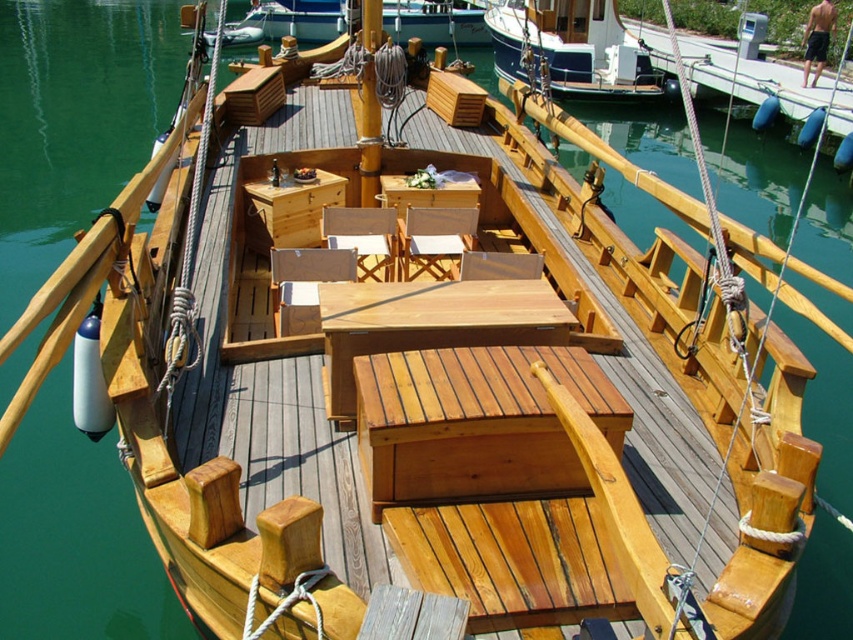
Is light brown wood table at center smaller than white painted wood boat at upper center?

Yes.

Describe the element at coordinates (430, 323) in the screenshot. I see `light brown wood table at center` at that location.

Find the location of a particular element. Image resolution: width=853 pixels, height=640 pixels. light brown wood table at center is located at coordinates (430, 323).

Between natural wood bench at center and white painted wood boat at upper center, which one has less height?

With less height is natural wood bench at center.

Does natural wood bench at center have a larger size compared to white painted wood boat at upper center?

Incorrect, natural wood bench at center is not larger than white painted wood boat at upper center.

Is point (492, 488) farther from camera compared to point (604, 0)?

No, it is not.

Find the location of a particular element. Image resolution: width=853 pixels, height=640 pixels. natural wood bench at center is located at coordinates (474, 422).

Does natural wood bench at center appear on the right side of smooth wood mast at center?

Indeed, natural wood bench at center is positioned on the right side of smooth wood mast at center.

Who is lower down, natural wood bench at center or smooth wood mast at center?

natural wood bench at center

Locate an element on the screen. Image resolution: width=853 pixels, height=640 pixels. natural wood bench at center is located at coordinates (474, 422).